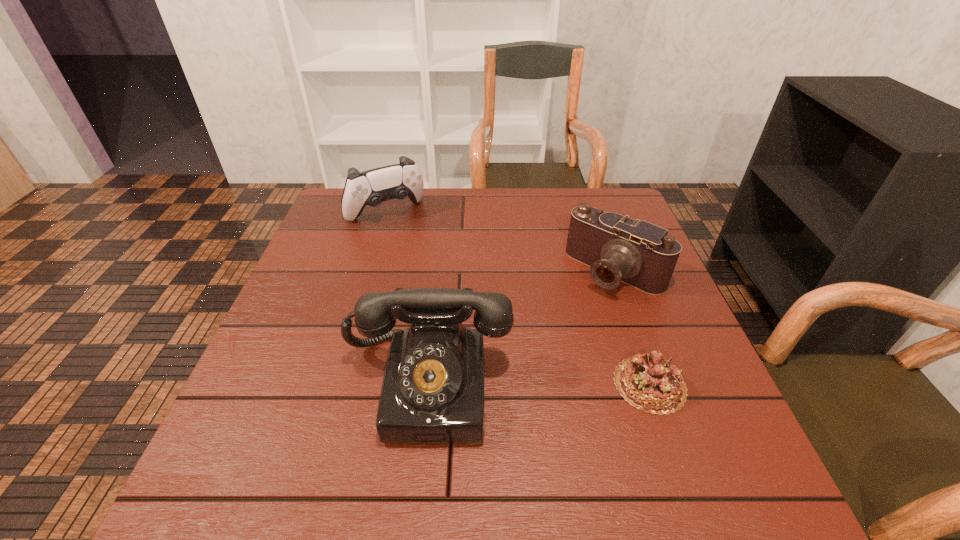
In order to click on the tallest object in this screenshot , I will do `click(432, 392)`.

At what (x,y) coordinates should I click in order to perform the action: click on chocolate cake. Please return your answer as a coordinate pair (x, y). Looking at the image, I should click on tap(650, 383).

Where is `camera`? This screenshot has width=960, height=540. camera is located at coordinates (618, 249).

The height and width of the screenshot is (540, 960). I want to click on the farthest object, so click(x=372, y=187).

Where is `vacant position located on the left of the chocolate cake`? Image resolution: width=960 pixels, height=540 pixels. vacant position located on the left of the chocolate cake is located at coordinates (507, 384).

This screenshot has width=960, height=540. Identify the location of vacant space positioned on the front-facing side of the camera. (535, 356).

Find the location of a particular element. The image size is (960, 540). blank space located on the front-facing side of the camera is located at coordinates click(x=540, y=350).

Identify the location of vacant space situated on the front-facing side of the camera. (489, 403).

This screenshot has width=960, height=540. Find the location of `free space located on the front-facing side of the farthest object`. free space located on the front-facing side of the farthest object is located at coordinates (459, 305).

Locate an element on the screen. The height and width of the screenshot is (540, 960). vacant region located 0.320m on the front-facing side of the farthest object is located at coordinates (451, 295).